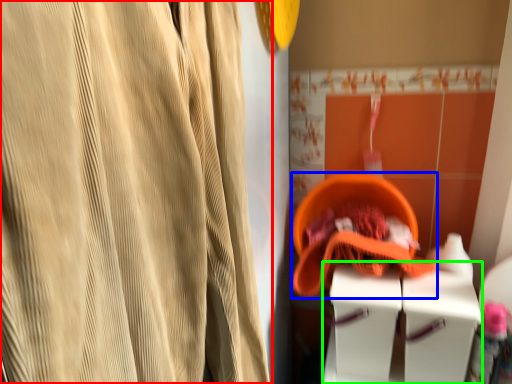
Question: Based on their relative distances, which object is farther from curtain (highlighted by a red box)? Choose from basket (highlighted by a blue box) and vanity (highlighted by a green box).

Choices:
 (A) basket
 (B) vanity

Answer: (A)